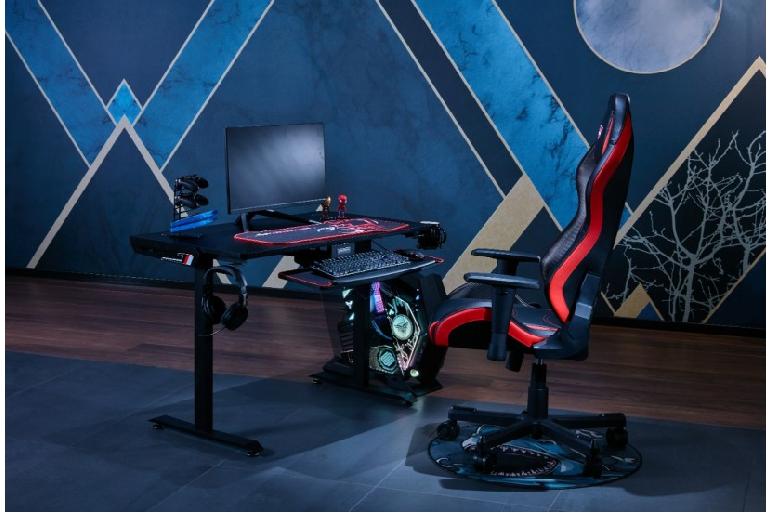
Locate an element on the screen. This screenshot has width=768, height=512. computer mouse is located at coordinates (412, 253).